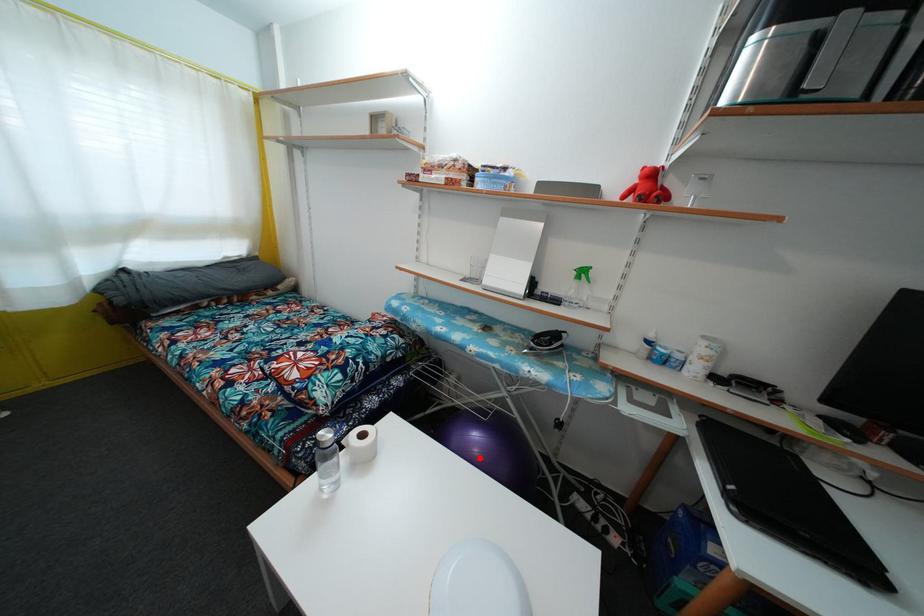
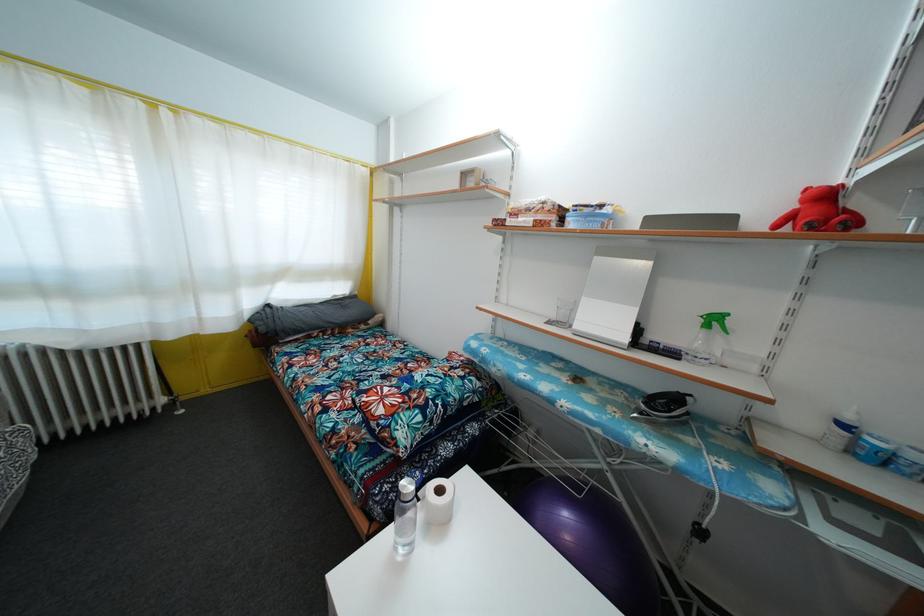
Question: I am providing you with two images of the same scene from different viewpoints. Image1 has a red point marked. In image2, the corresponding 3D location appears at what relative position? Reply with the corresponding letter.

Choices:
 (A) Closer
 (B) Farther

Answer: (A)